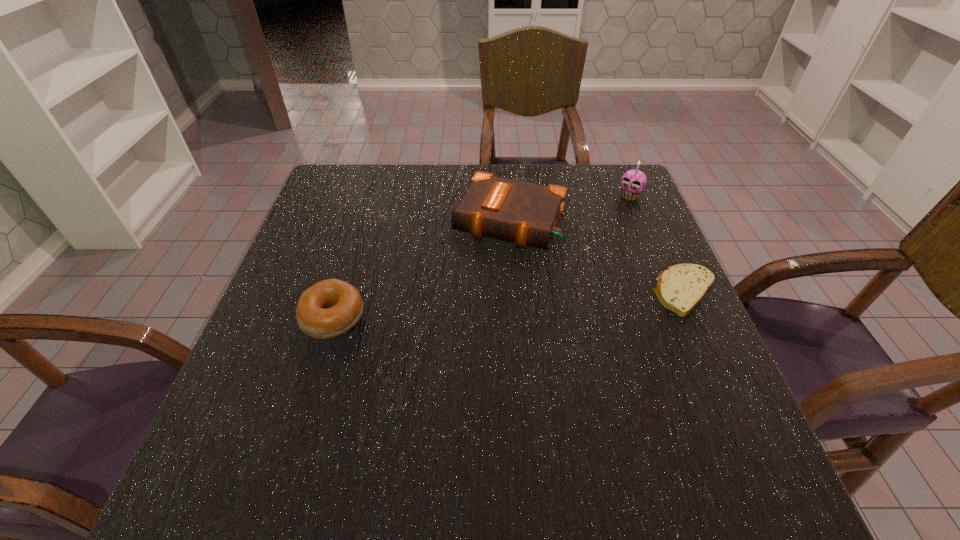
Locate an element on the screen. Image resolution: width=960 pixels, height=540 pixels. free space located on the face of the cupcake is located at coordinates (573, 268).

The width and height of the screenshot is (960, 540). Find the location of `free space located 0.320m on the spine side of the third shortest object`. free space located 0.320m on the spine side of the third shortest object is located at coordinates (443, 359).

Locate an element on the screen. This screenshot has height=540, width=960. free spot located 0.330m on the spine side of the third shortest object is located at coordinates (441, 362).

You are a GUI agent. You are given a task and a screenshot of the screen. Output one action in this format:
    pyautogui.click(x=<x>, y=<y>)
    Task: Click on the free region located on the spine side of the third shortest object
    The height and width of the screenshot is (540, 960).
    Given the screenshot: What is the action you would take?
    pyautogui.click(x=468, y=303)

Find the location of a particular element. This screenshot has width=960, height=540. cupcake that is at the far edge is located at coordinates (633, 182).

Identify the location of Bible that is at the far edge. This screenshot has width=960, height=540. (525, 213).

Where is `object that is at the left edge`? The image size is (960, 540). object that is at the left edge is located at coordinates (328, 309).

Find the location of a particular element. This screenshot has width=960, height=540. pita bread that is at the right edge is located at coordinates (680, 288).

What are the coordinates of `cupcake present at the right edge` in the screenshot? It's located at (633, 182).

Identify the location of object that is at the far right corner. tap(633, 182).